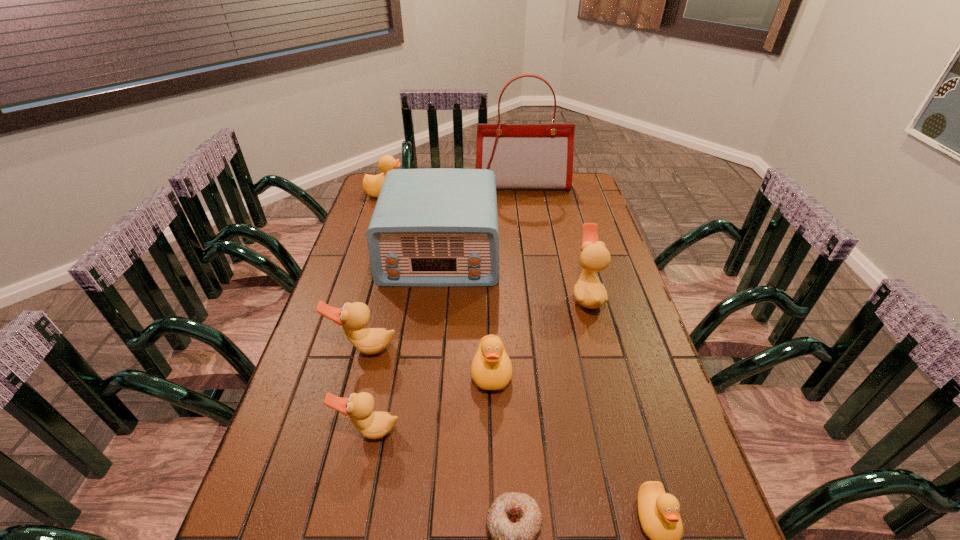
In order to click on blank space located on the beak of the nearest tan duck in this screenshot , I will do `click(359, 480)`.

Where is `handbag that is at the far edge`? handbag that is at the far edge is located at coordinates (522, 156).

The width and height of the screenshot is (960, 540). Find the location of `duck that is at the far edge`. duck that is at the far edge is located at coordinates (372, 184).

Image resolution: width=960 pixels, height=540 pixels. Identify the location of radio receiver present at the left edge. [438, 227].

Locate an element on the screen. The width and height of the screenshot is (960, 540). handbag that is at the right edge is located at coordinates (522, 156).

The width and height of the screenshot is (960, 540). I want to click on duck that is positioned at the right edge, so click(x=588, y=291).

Locate an element on the screen. object at the far left corner is located at coordinates (372, 184).

Identify the location of object at the far right corner. (522, 156).

Where is `vacant region at the left edge of the desktop`? Image resolution: width=960 pixels, height=540 pixels. vacant region at the left edge of the desktop is located at coordinates (313, 512).

Find the location of a particular element. free space at the right edge of the desktop is located at coordinates (642, 474).